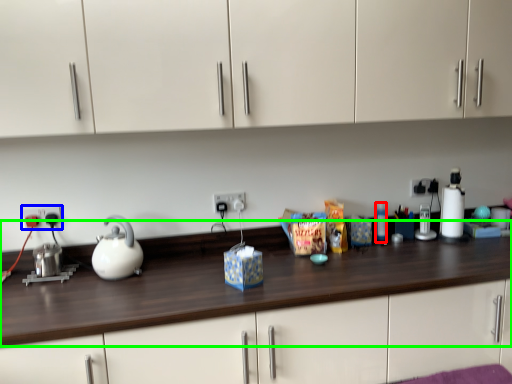
Question: Based on their relative distances, which object is nearer to bottle (highlighted by a red box)? Choose from electric outlet (highlighted by a blue box) and counter top (highlighted by a green box).

Choices:
 (A) electric outlet
 (B) counter top

Answer: (B)